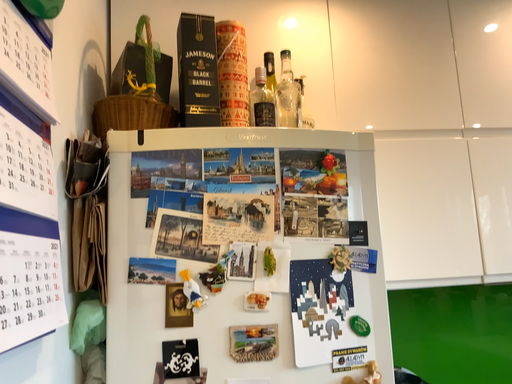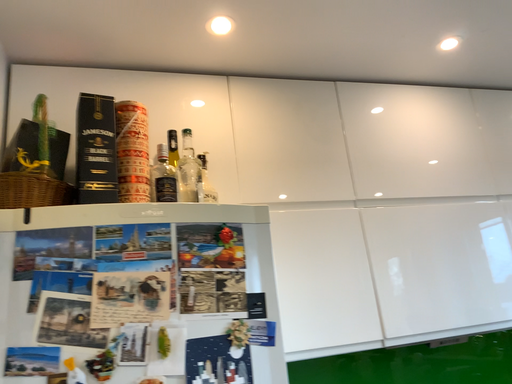
Question: How did the camera likely rotate when shooting the video?

Choices:
 (A) rotated left
 (B) rotated right

Answer: (B)